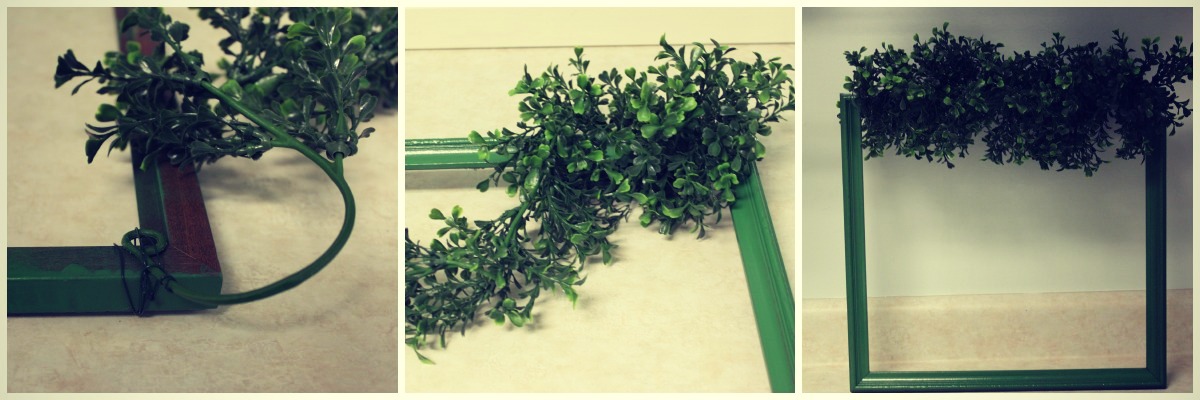
The height and width of the screenshot is (400, 1200). What are the coordinates of `3 plants` in the screenshot? It's located at (289, 56), (598, 155), (1068, 116).